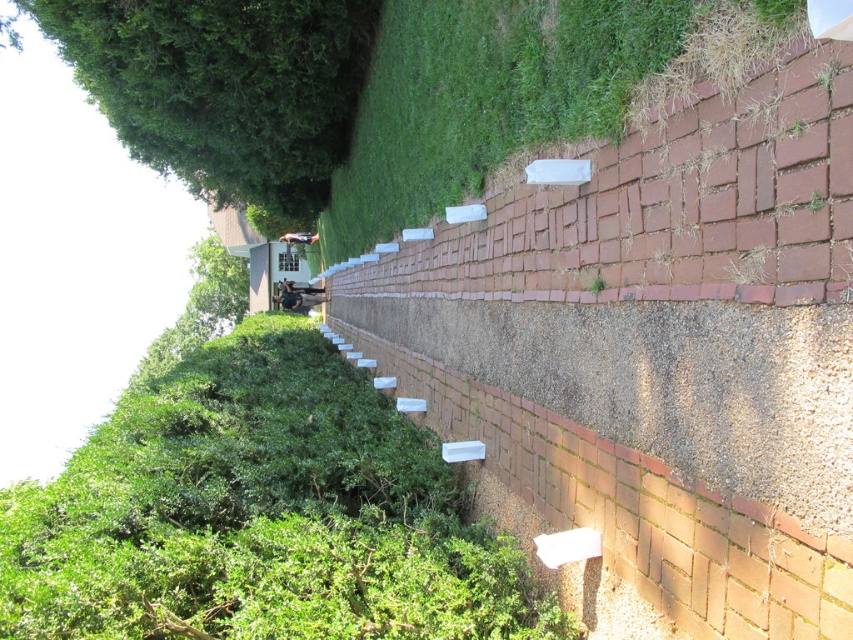
You are standing at the entrance of the pathway and want to walk towards the point that is closer to you. Which point should you head towards, point (418, 225) or point (299, 301)?

You should head towards point (418, 225) because it is closer to the viewer than point (299, 301) according to the description.

You are standing at the point marked by the coordinates point (521, 92), which is in the center of the image. Looking around, you see a brick wall on one side and lush greenery on the other. Which direction should you walk to reach the green grass at center?

The point 0.144, 013 marks green grass at center, so you are already standing on the green grass at center. There is no need to walk further in any direction.

You are standing on the pathway bordered by a brick wall and greenery. You see the green grass at center and the dark gray fabric man at center. Which object takes up more space in the scene?

The green grass at center takes up more space in the scene because it is larger in size than the dark gray fabric man at center.